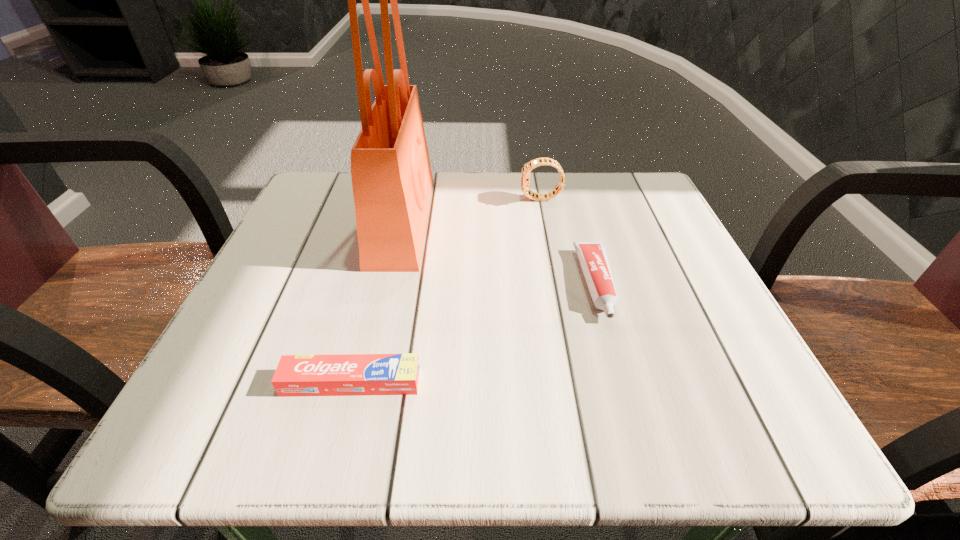
Identify the location of tote bag. Image resolution: width=960 pixels, height=540 pixels. (392, 181).

This screenshot has height=540, width=960. I want to click on the second tallest object, so click(x=525, y=174).

Find the location of a particular element. Image resolution: width=960 pixels, height=540 pixels. the farther toothpaste is located at coordinates (592, 255).

Image resolution: width=960 pixels, height=540 pixels. Find the location of `the nearest object`. the nearest object is located at coordinates (345, 374).

Locate an element on the screen. This screenshot has width=960, height=540. the left toothpaste is located at coordinates (345, 374).

You are a GUI agent. You are given a task and a screenshot of the screen. Output one action in this format:
    pyautogui.click(x=<x>, y=<y>)
    Task: Click on the free space located on the logo side of the tote bag
    The height and width of the screenshot is (540, 960).
    Given the screenshot: What is the action you would take?
    pyautogui.click(x=559, y=220)

At what (x,y) coordinates should I click in order to perform the action: click on free location located 0.300m on the face of the watch. Please return your answer as a coordinate pair (x, y). Looking at the image, I should click on (386, 199).

You are a GUI agent. You are given a task and a screenshot of the screen. Output one action in this format:
    pyautogui.click(x=<x>, y=<y>)
    Task: Click on the vacant area situated on the face of the watch
    
    Given the screenshot: What is the action you would take?
    pyautogui.click(x=341, y=199)

Where is `free space located 0.330m on the face of the watch`? The height and width of the screenshot is (540, 960). free space located 0.330m on the face of the watch is located at coordinates (372, 199).

This screenshot has height=540, width=960. I want to click on vacant space located at the nozzle of the right toothpaste, so click(625, 382).